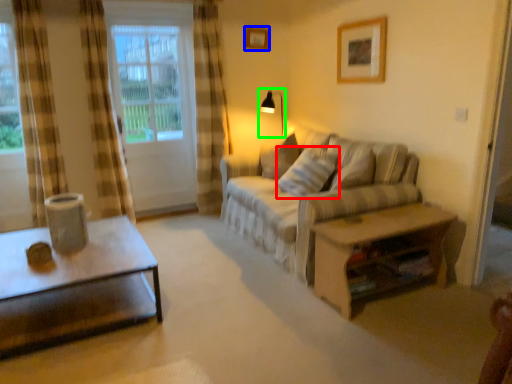
Question: Which object is positioned farthest from pillow (highlighted by a red box)? Select from picture frame (highlighted by a blue box) and table lamp (highlighted by a green box).

Choices:
 (A) picture frame
 (B) table lamp

Answer: (A)